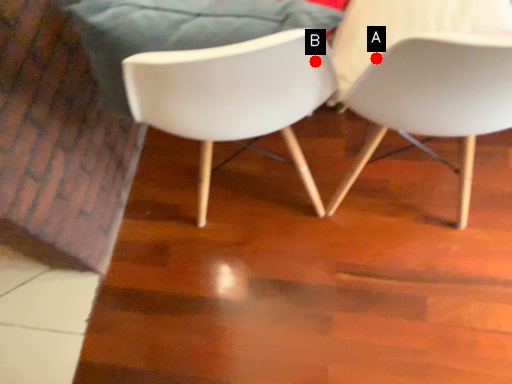
Question: Two points are circled on the image, labeled by A and B beside each circle. Which point is closer to the camera?

Choices:
 (A) A is closer
 (B) B is closer

Answer: (B)